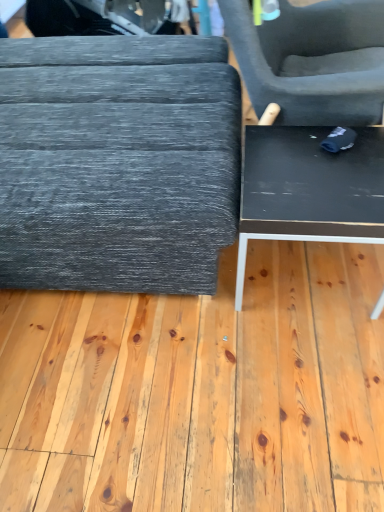
Question: Looking at the image, does black matte plywood at center seem bigger or smaller compared to matte gray ottoman at left, the 1th table viewed from the left?

Choices:
 (A) small
 (B) big

Answer: (A)

Question: Choose the correct answer: Is black matte plywood at center inside matte gray ottoman at left, acting as the 2th table starting from the right, or outside it?

Choices:
 (A) outside
 (B) inside

Answer: (A)

Question: Based on their relative distances, which object is nearer to the matte gray ottoman at left, acting as the 2th table starting from the right?

Choices:
 (A) black matte plywood at center
 (B) black glossy table at lower right, the 2th table positioned from the left

Answer: (B)

Question: Based on their relative distances, which object is nearer to the black glossy table at lower right, arranged as the first table when viewed from the right?

Choices:
 (A) matte gray ottoman at left, the 1th table viewed from the left
 (B) black matte plywood at center

Answer: (A)